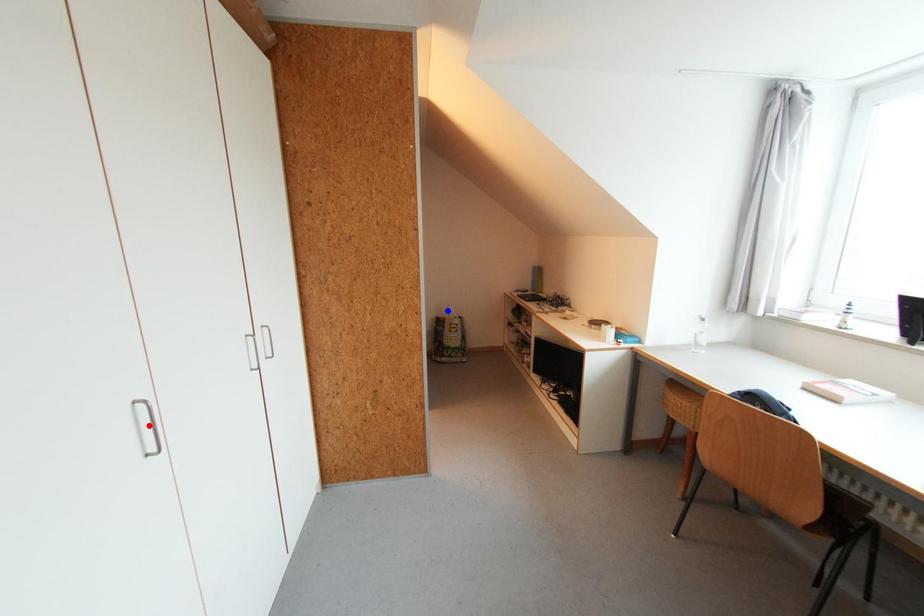
Question: In the image, two points are highlighted. Which point is nearer to the camera? Reply with the corresponding letter.

Choices:
 (A) blue point
 (B) red point

Answer: (B)